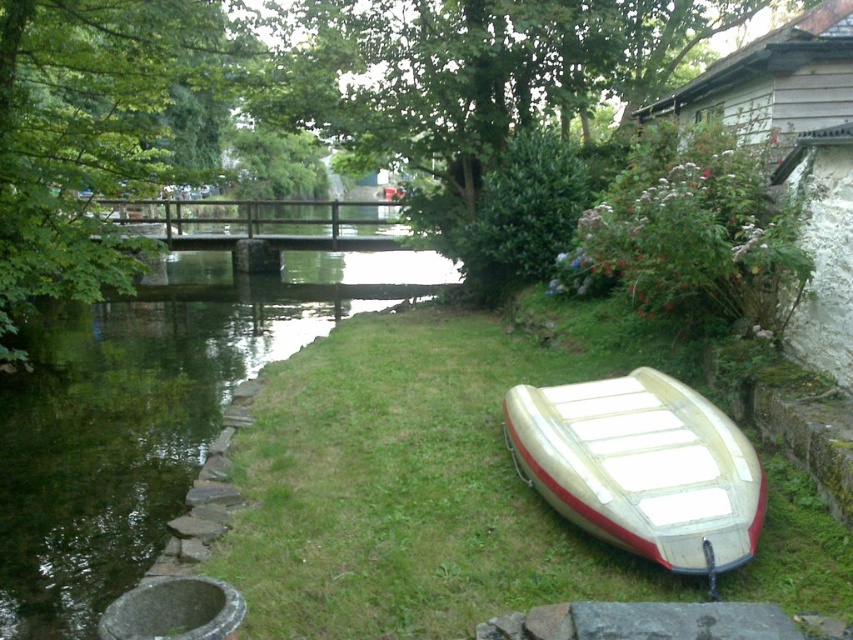
You are a photographer setting up a tripod to capture the white matte boat at lower right. Since the green grass at lower right is in the way, can you determine if you need to trim the grass to get a clear view of the boat?

The green grass at lower right is taller than the white matte boat at lower right, so trimming the grass would be necessary to ensure the boat is fully visible without obstruction.

You are planning to set up a picnic blanket in the riverside scene. You have a picnic blanket that is 2 meters wide. You see the green grass at lower right and the white matte boat at lower right. Which area would you choose to place your picnic blanket and why?

The green grass at lower right is larger in size than the white matte boat at lower right, so you should choose the green grass at lower right because it has enough space to accommodate the 2 meter wide picnic blanket.